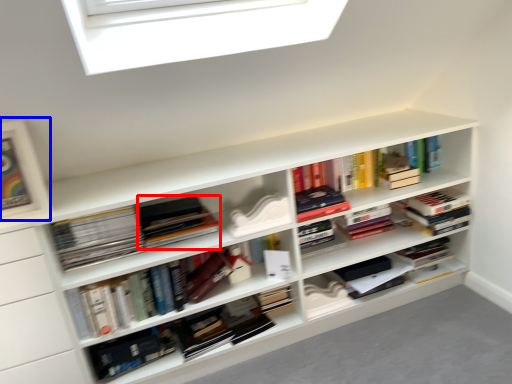
Question: Among these objects, which one is farthest to the camera, book (highlighted by a red box) or picture frame (highlighted by a blue box)?

Choices:
 (A) book
 (B) picture frame

Answer: (A)